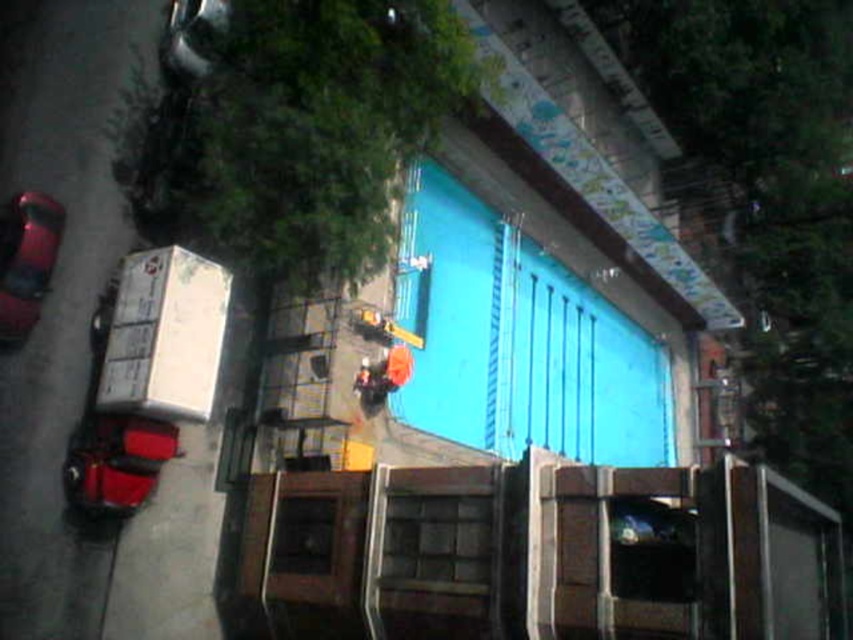
Can you confirm if shiny red car at left is shorter than orange fabric construction worker at center?

No, shiny red car at left is not shorter than orange fabric construction worker at center.

Is shiny red car at left to the left of orange fabric construction worker at center from the viewer's perspective?

Indeed, shiny red car at left is positioned on the left side of orange fabric construction worker at center.

Which is behind, point (3, 237) or point (387, 349)?

Point (387, 349)

Find the location of a particular element. shiny red car at left is located at coordinates (26, 260).